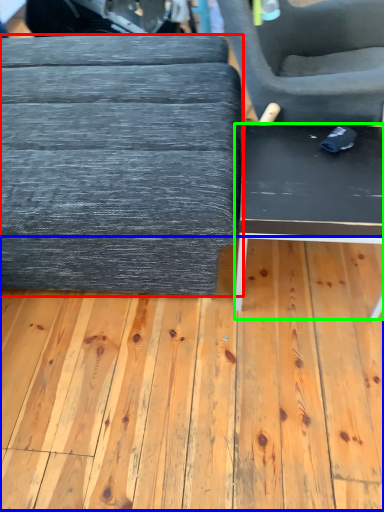
Question: Which object is the closest to the table (highlighted by a red box)? Choose among these: plywood (highlighted by a blue box) or table (highlighted by a green box).

Choices:
 (A) plywood
 (B) table

Answer: (B)